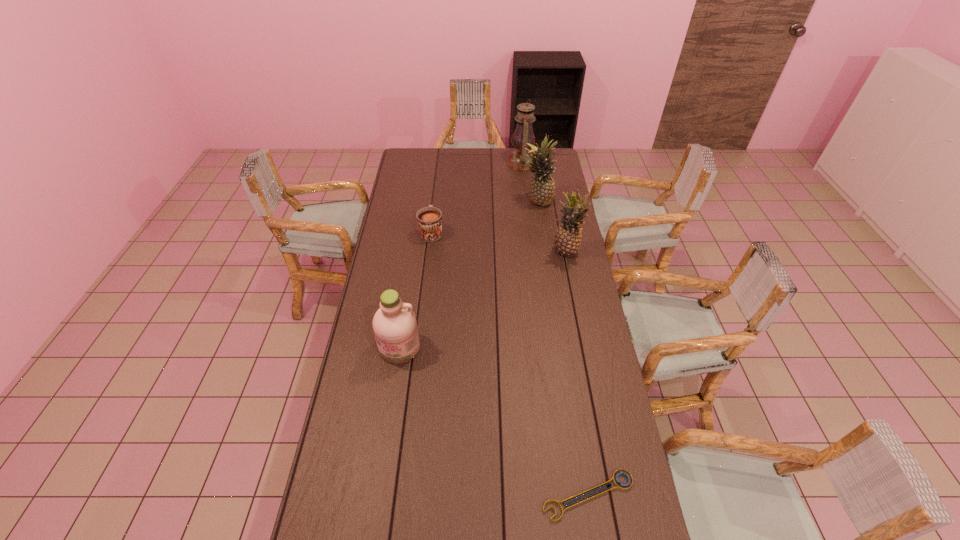
Identify the location of free space located on the front label of the second nearest object. This screenshot has width=960, height=540. (386, 435).

The image size is (960, 540). In order to click on vacant area situated on the side of the mug with the handle in this screenshot , I will do `click(437, 186)`.

Where is `vacant point located 0.120m on the side of the mug with the handle`? This screenshot has width=960, height=540. vacant point located 0.120m on the side of the mug with the handle is located at coordinates (435, 206).

In order to click on vacant space located 0.240m on the side of the mug with the handle in this screenshot , I will do `click(436, 192)`.

Where is `blank space located on the left of the wrench`? The width and height of the screenshot is (960, 540). blank space located on the left of the wrench is located at coordinates (492, 495).

Locate an element on the screen. object present at the far edge is located at coordinates (518, 160).

You are a GUI agent. You are given a task and a screenshot of the screen. Output one action in this format:
    pyautogui.click(x=<x>, y=<y>)
    Task: Click on the object that is at the left edge
    
    Given the screenshot: What is the action you would take?
    pyautogui.click(x=395, y=327)

I want to click on oil lamp at the right edge, so (x=518, y=160).

At what (x,y) coordinates should I click in order to perform the action: click on wrench that is at the right edge. Please return your answer as a coordinate pair (x, y). Looking at the image, I should click on (623, 472).

Image resolution: width=960 pixels, height=540 pixels. What are the coordinates of `object that is at the far right corner` in the screenshot? It's located at (x=518, y=160).